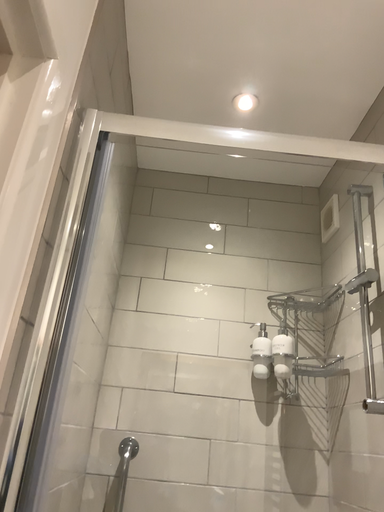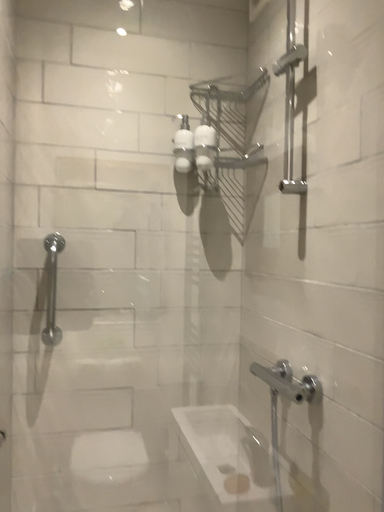
Question: How did the camera likely rotate when shooting the video?

Choices:
 (A) rotated upward
 (B) rotated downward

Answer: (B)